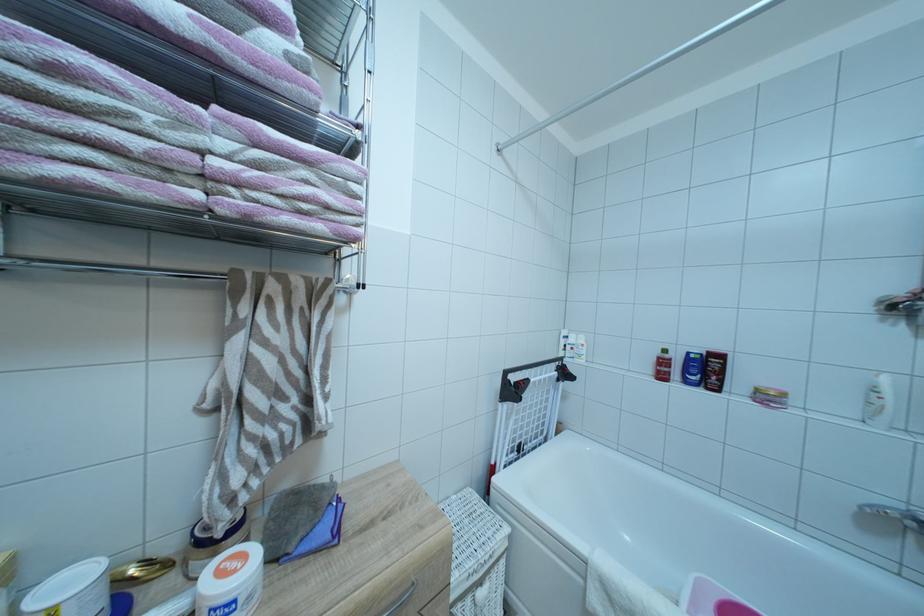
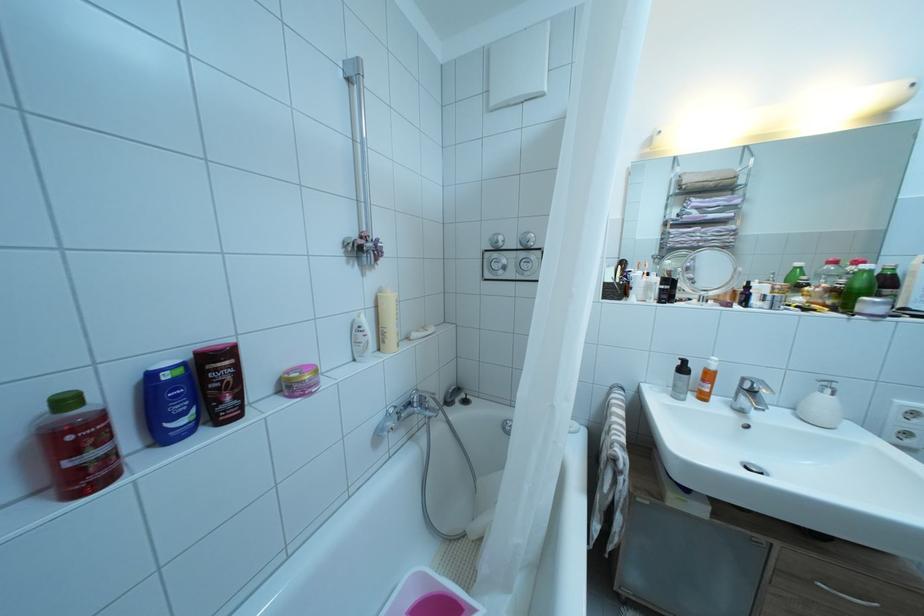
Question: Based on the continuous images, in which direction is the camera rotating? Reply with the corresponding letter.

Choices:
 (A) Left
 (B) Right
 (C) Up
 (D) Down

Answer: (B)